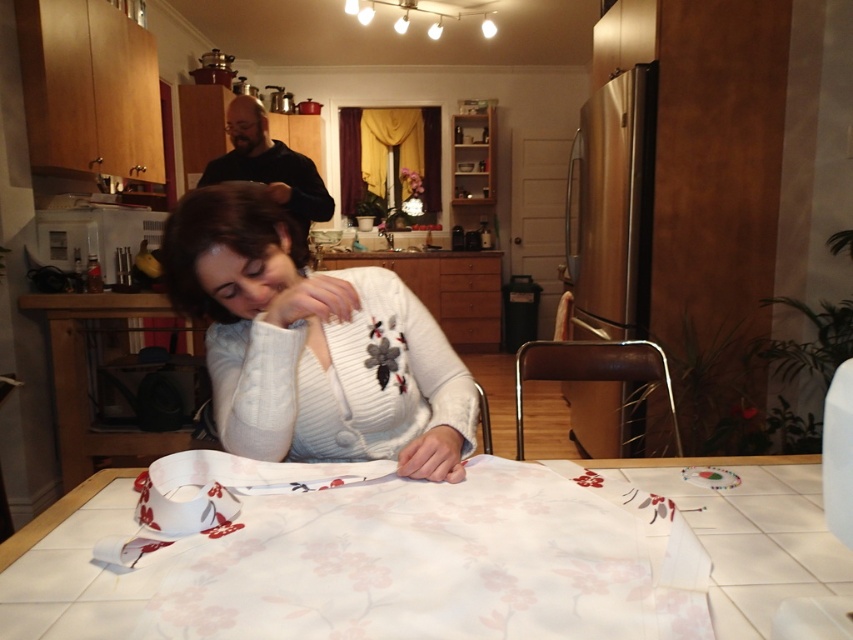
Is white knit sweater at center smaller than white fabric at center?

No.

Does white knit sweater at center have a greater width compared to white fabric at center?

Correct, the width of white knit sweater at center exceeds that of white fabric at center.

Between point (238, 364) and point (744, 470), which one is positioned behind?

The point (238, 364) is more distant.

Find the location of `white knit sweater at center`. white knit sweater at center is located at coordinates (312, 346).